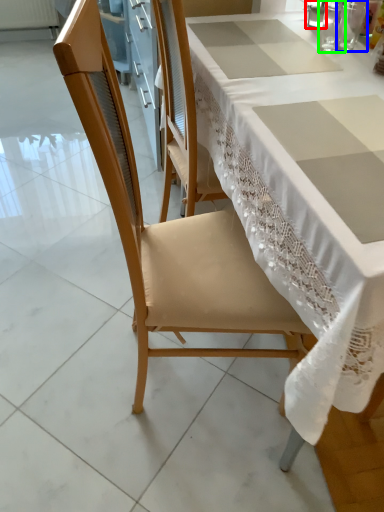
Question: Based on their relative distances, which object is nearer to tableware (highlighted by a red box)? Choose from tableware (highlighted by a blue box) and tableware (highlighted by a green box).

Choices:
 (A) tableware
 (B) tableware

Answer: (B)